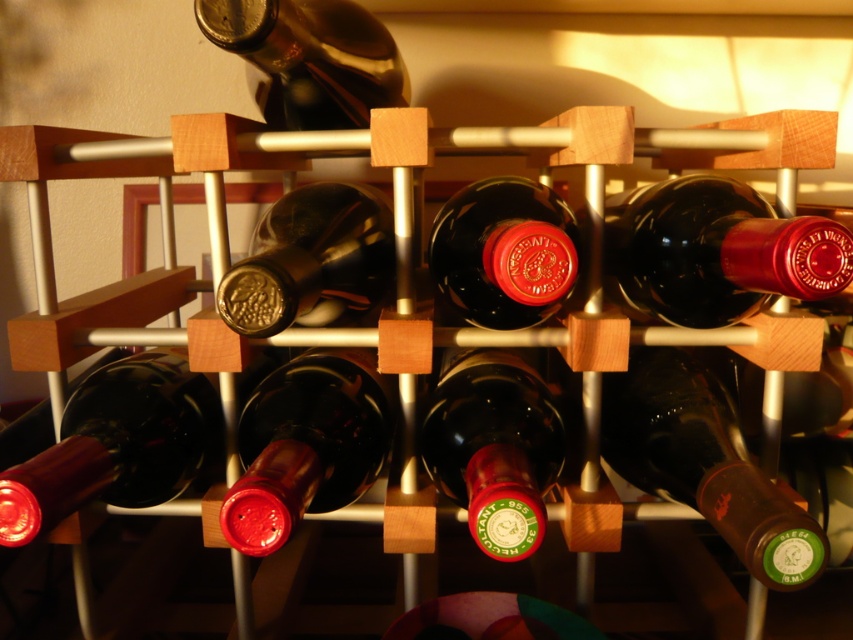
Question: Is shiny dark red bottle at center to the left of matte glass bottle at center from the viewer's perspective?

Choices:
 (A) no
 (B) yes

Answer: (A)

Question: Which point is closer to the camera?

Choices:
 (A) (235, 296)
 (B) (473, 248)
 (C) (669, 408)

Answer: (A)

Question: Is matte glass bottle at center below shiny dark glass bottle at upper center?

Choices:
 (A) no
 (B) yes

Answer: (B)

Question: Is matte black bottle at center wider than matte glass bottle at center?

Choices:
 (A) yes
 (B) no

Answer: (A)

Question: Which is farther from the shiny dark glass bottle at upper center?

Choices:
 (A) matte glass bottle at center
 (B) matte dark red wine bottle at lower left
 (C) green matte wine bottle at center

Answer: (C)

Question: Which point is farther from the camera taking this photo?

Choices:
 (A) (746, 228)
 (B) (280, 86)
 (C) (531, 513)
 (D) (302, 305)

Answer: (B)